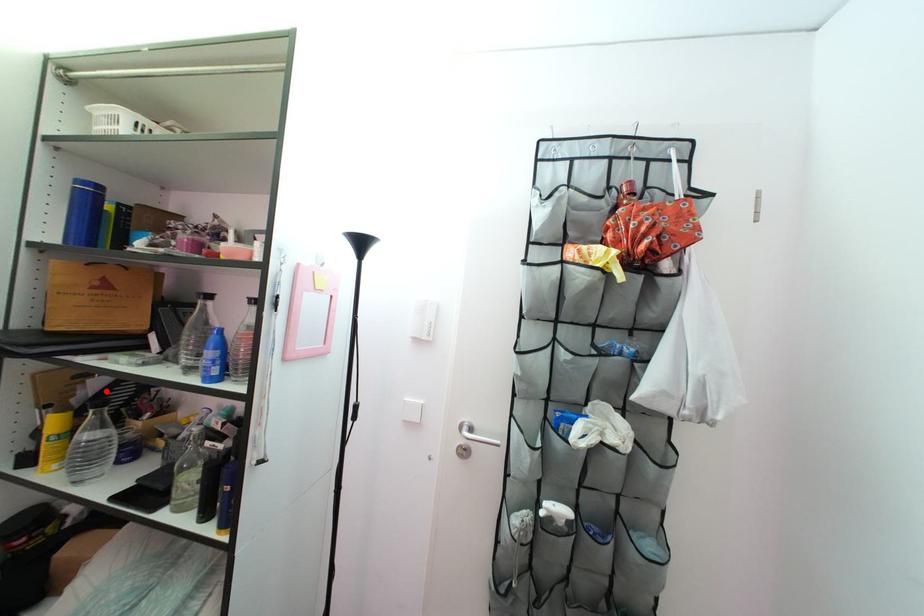
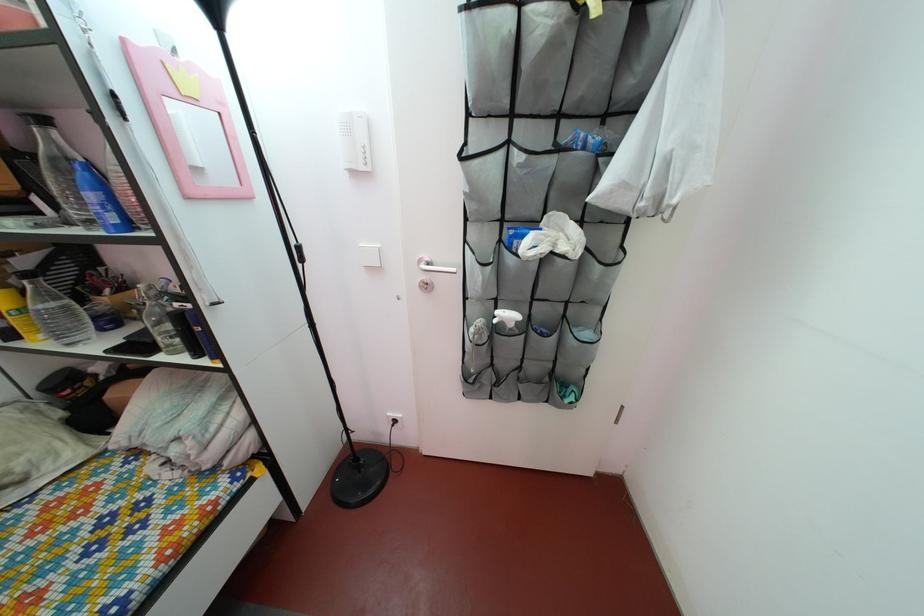
Question: I am providing you with two images of the same scene from different viewpoints. In image1, a red point is highlighted. Considering the same 3D point in image2, which of the following is correct?

Choices:
 (A) It is closer
 (B) It is farther

Answer: (B)